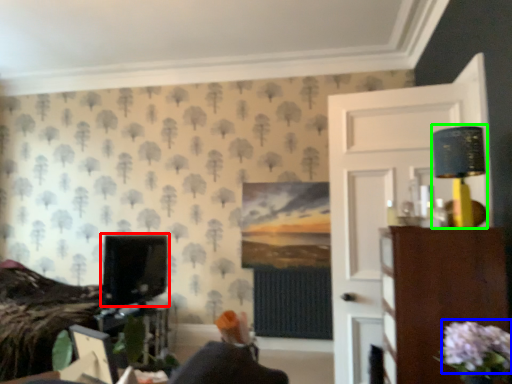
Question: Which is farther away from computer monitor (highlighted by a red box)? flower (highlighted by a blue box) or table lamp (highlighted by a green box)?

Choices:
 (A) flower
 (B) table lamp

Answer: (A)